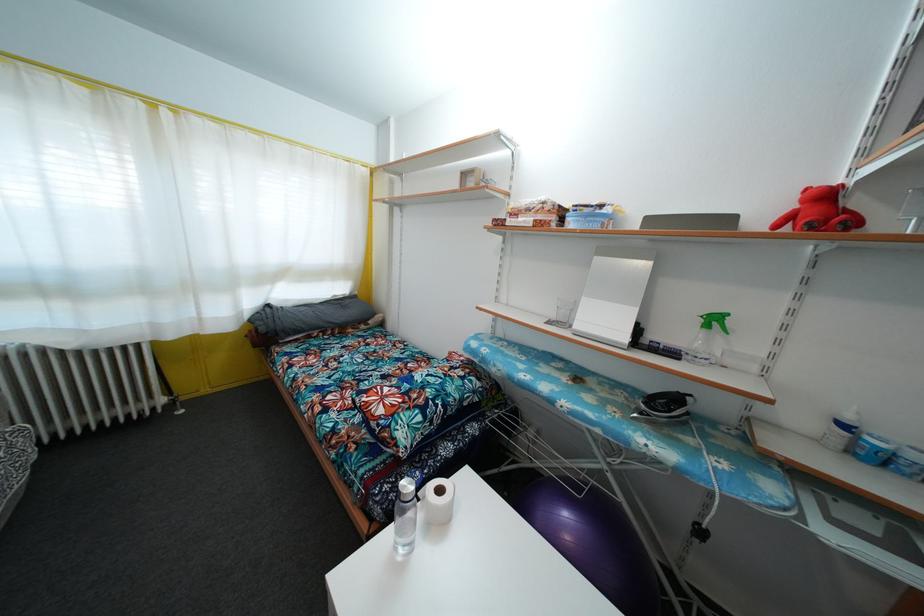
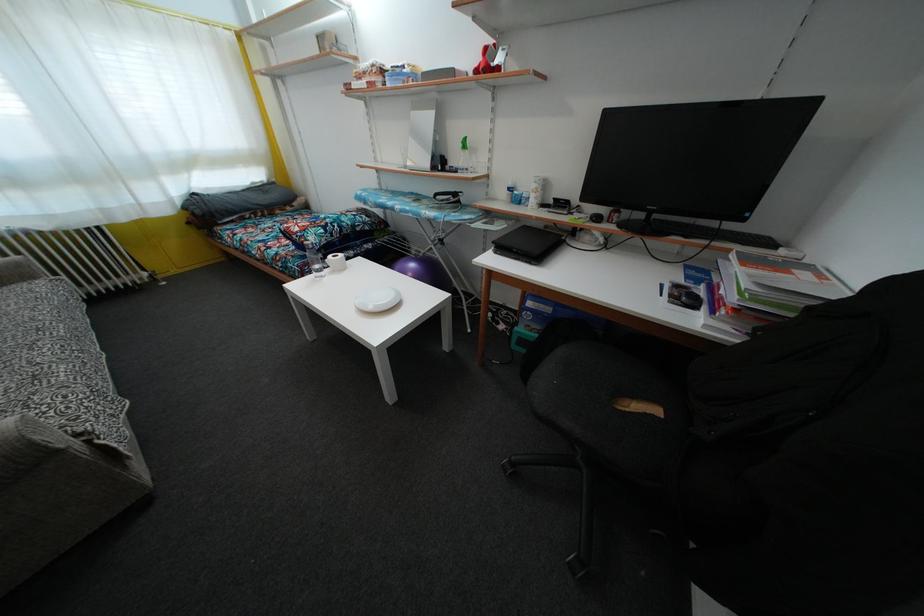
Find the pixel in the second image that matches the point at 387,435 in the first image.

(305, 244)